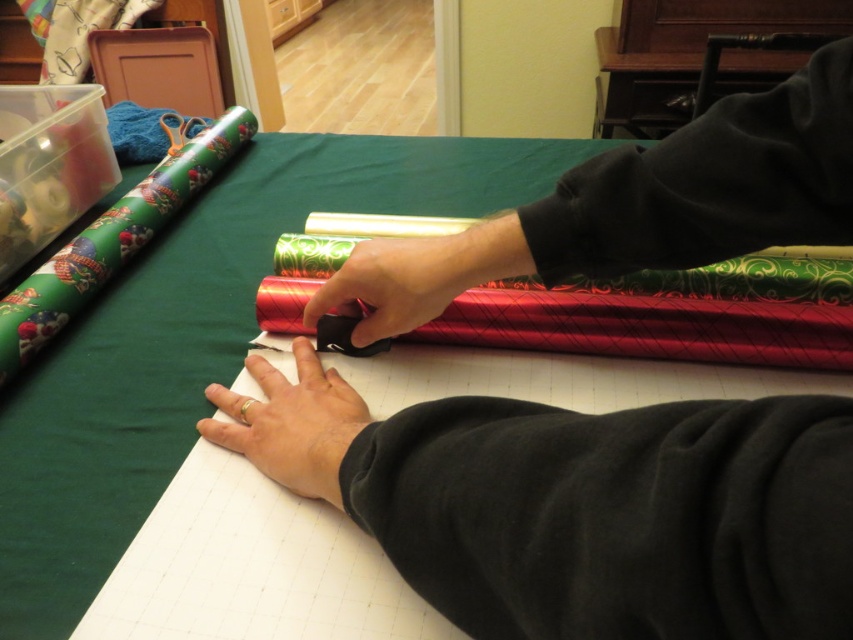
Is gold ring at lower center above black matte scissors at center?

No.

Based on the photo, is the position of gold ring at lower center more distant than that of black matte scissors at center?

No, gold ring at lower center is in front of black matte scissors at center.

Find the location of `gold ring at lower center`. gold ring at lower center is located at coordinates (289, 422).

Where is `gold ring at lower center`? The image size is (853, 640). gold ring at lower center is located at coordinates (289, 422).

Who is shorter, black fleece at lower right or green fabric at upper right?

Standing shorter between the two is black fleece at lower right.

Looking at this image, does black fleece at lower right appear under green fabric at upper right?

Correct, black fleece at lower right is located below green fabric at upper right.

Identify the location of black fleece at lower right. Image resolution: width=853 pixels, height=640 pixels. (616, 516).

Can you confirm if black fleece at lower right is positioned above black matte scissors at center?

No, black fleece at lower right is not above black matte scissors at center.

Which of these two, black fleece at lower right or black matte scissors at center, stands shorter?

black matte scissors at center

Who is more forward, (709, 586) or (309, 321)?

Point (709, 586) is in front.

The width and height of the screenshot is (853, 640). What are the coordinates of `black fleece at lower right` in the screenshot? It's located at (616, 516).